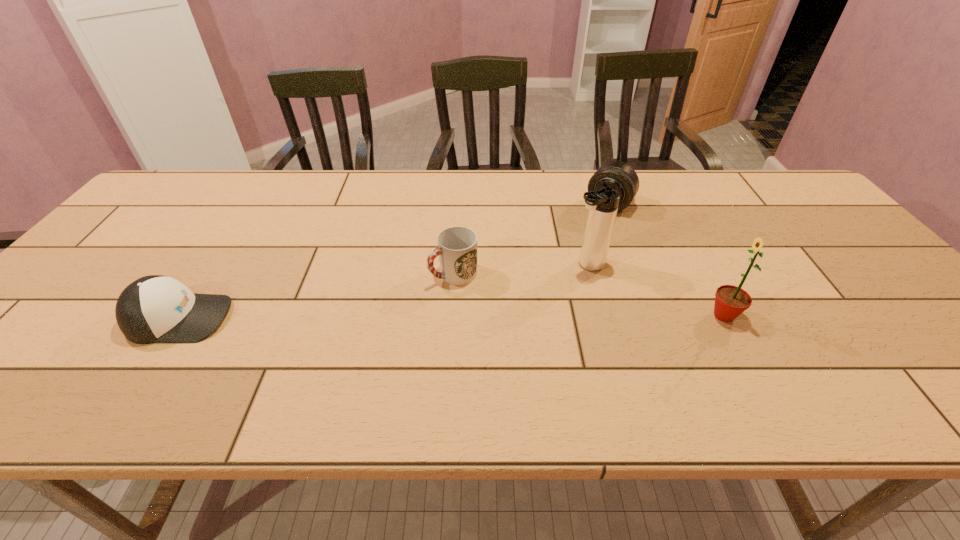
Locate an element on the screen. The height and width of the screenshot is (540, 960). cap is located at coordinates (153, 309).

Find the location of a particular element. the rightmost object is located at coordinates (730, 301).

You are a GUI agent. You are given a task and a screenshot of the screen. Output one action in this format:
    pyautogui.click(x=<x>, y=<y>)
    Task: Click on the thermos bottle
    This screenshot has width=960, height=540.
    Given the screenshot: What is the action you would take?
    pyautogui.click(x=603, y=203)

Find the location of `telephoto lens`. telephoto lens is located at coordinates (620, 176).

The height and width of the screenshot is (540, 960). In order to click on the farthest object in this screenshot , I will do `click(620, 176)`.

Locate an element on the screen. This screenshot has height=540, width=960. the fourth object from right to left is located at coordinates point(457,246).

The width and height of the screenshot is (960, 540). I want to click on free space located 0.370m on the front panel of the cap, so click(391, 318).

Find the location of a particular element. vacant area situated on the face of the rightmost object is located at coordinates (581, 315).

Where is `vacant space located 0.150m on the face of the rightmost object`? The image size is (960, 540). vacant space located 0.150m on the face of the rightmost object is located at coordinates (642, 315).

You are a GUI agent. You are given a task and a screenshot of the screen. Output one action in this format:
    pyautogui.click(x=<x>, y=<y>)
    Task: Click on the blank area located on the face of the rightmost object
    The height and width of the screenshot is (540, 960).
    Given the screenshot: What is the action you would take?
    pyautogui.click(x=637, y=315)